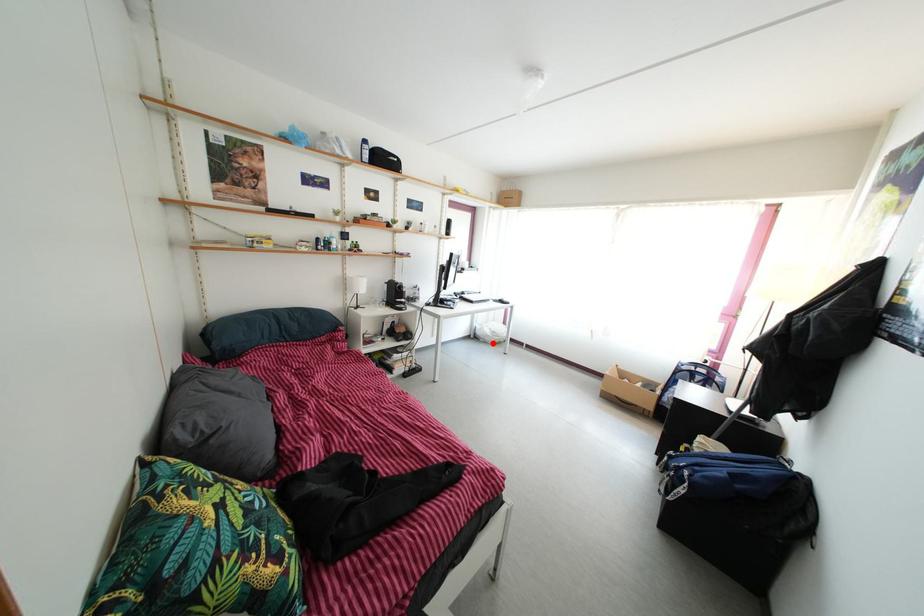
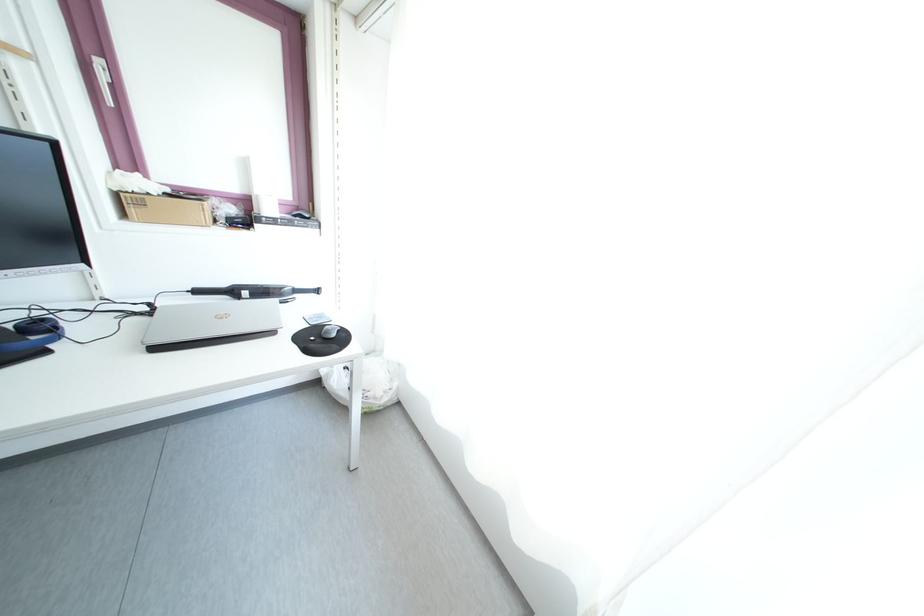
Question: I am providing you with two images of the same scene from different viewpoints. A red point is shown in image1. For the corresponding object point in image2, is it positioned nearer or farther from the camera?

Choices:
 (A) Nearer
 (B) Farther

Answer: (B)